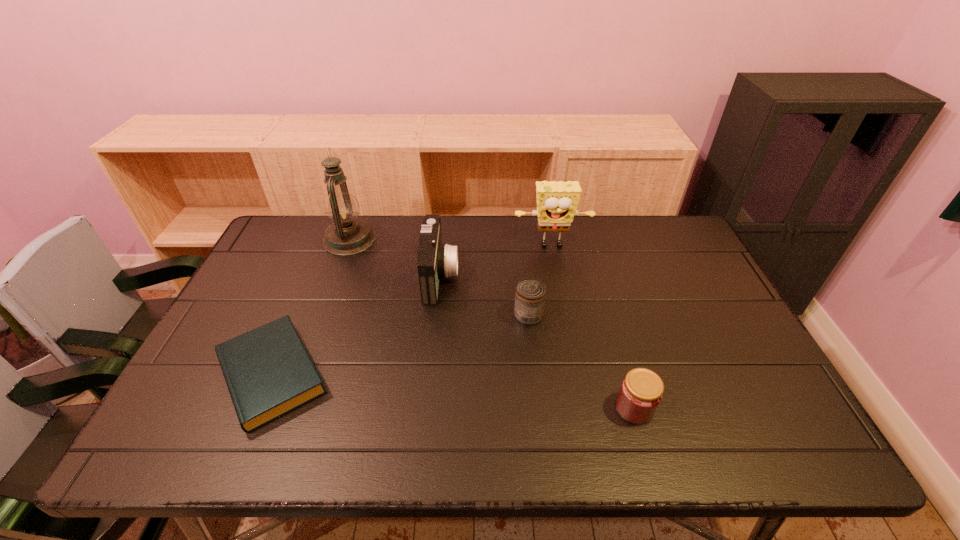
Locate an element on the screen. This screenshot has height=540, width=960. vacant space positioned on the front of the can is located at coordinates (543, 453).

Where is `blank space located 0.080m on the back of the jam`? blank space located 0.080m on the back of the jam is located at coordinates (622, 364).

Find the location of a particular element. free region located on the right of the shortest object is located at coordinates point(439,374).

This screenshot has height=540, width=960. Find the location of `oil lamp located at the far edge`. oil lamp located at the far edge is located at coordinates (347, 235).

Where is `sponge present at the far edge`? The height and width of the screenshot is (540, 960). sponge present at the far edge is located at coordinates (557, 202).

Locate an element on the screen. The image size is (960, 540). camcorder present at the far edge is located at coordinates (435, 260).

Where is `jam at the near edge`? The image size is (960, 540). jam at the near edge is located at coordinates (640, 394).

Identify the location of book at the near edge. This screenshot has height=540, width=960. (268, 371).

Where is `object that is at the left edge`? The image size is (960, 540). object that is at the left edge is located at coordinates (268, 371).

The width and height of the screenshot is (960, 540). I want to click on object present at the near left corner, so click(268, 371).